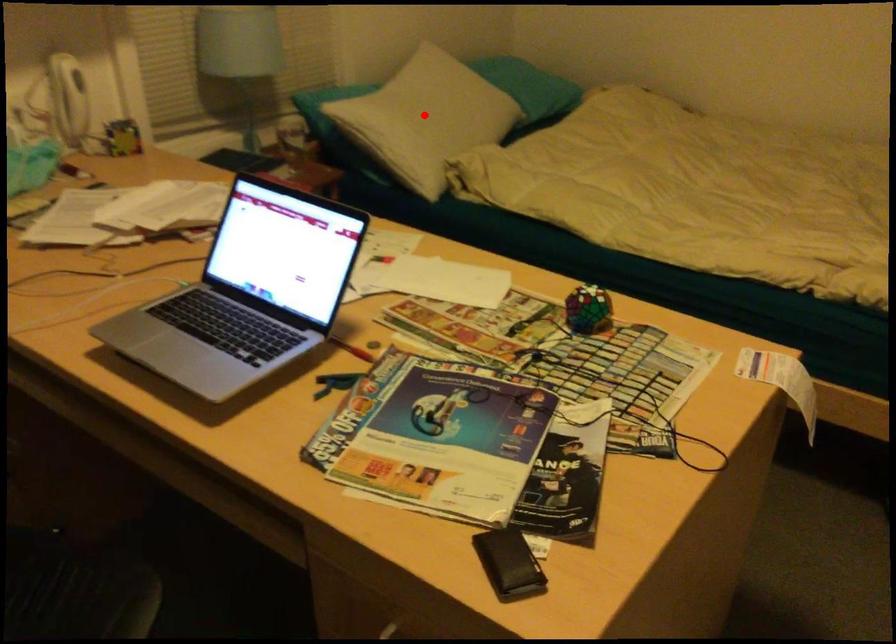
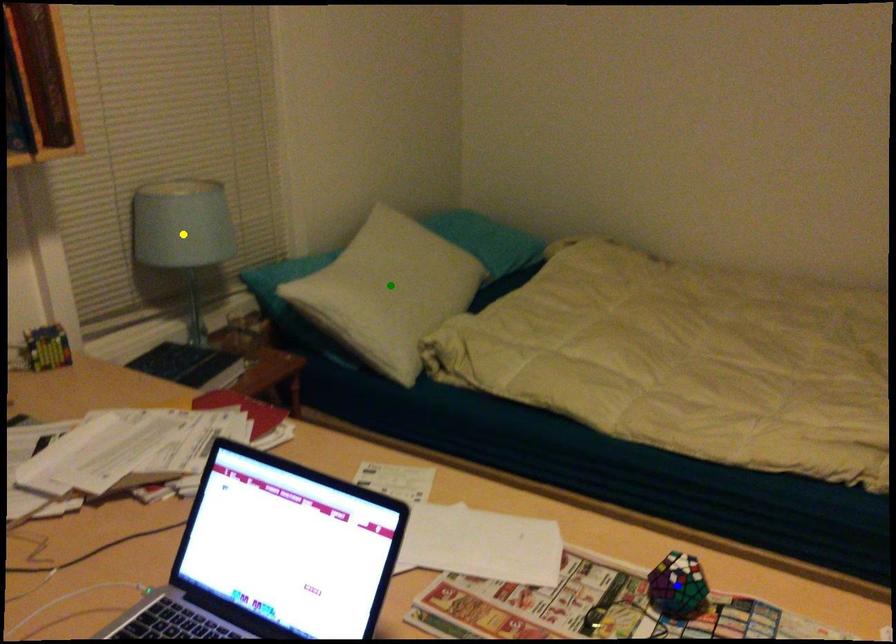
Question: I am providing you with two images of the same scene from different viewpoints. A red point is marked on the first image. You are given multiple points on the second image. In image 2, which mark is for the same physical point as the one in image 1?

Choices:
 (A) blue point
 (B) green point
 (C) yellow point

Answer: (B)